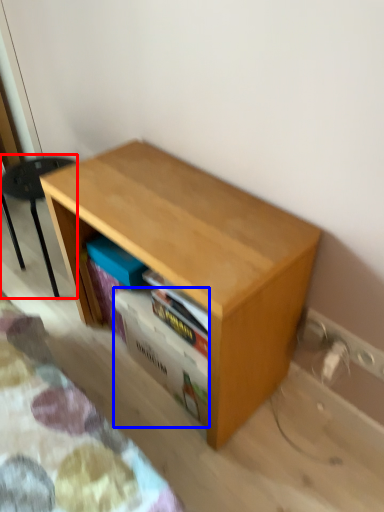
Question: Which object is closer to the camera taking this photo, furniture (highlighted by a red box) or shelf (highlighted by a blue box)?

Choices:
 (A) furniture
 (B) shelf

Answer: (B)